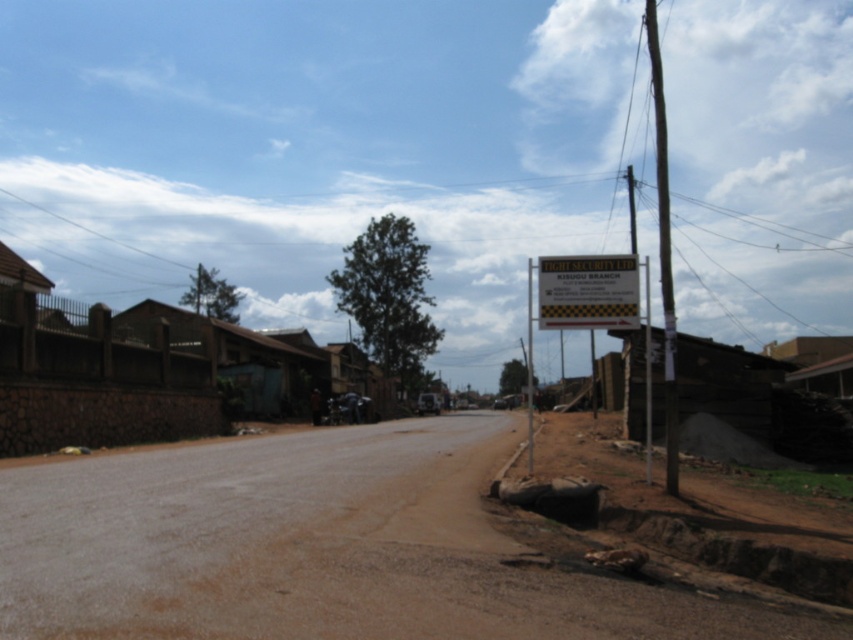
Question: Is metallic signboard at right to the right of smooth wood pole at right from the viewer's perspective?

Choices:
 (A) yes
 (B) no

Answer: (B)

Question: In this image, where is yellow/black checkered sign at center located relative to smooth wood pole at right?

Choices:
 (A) below
 (B) above

Answer: (A)

Question: Estimate the real-world distances between objects in this image. Which object is closer to the yellow/black checkered sign at center?

Choices:
 (A) smooth wood pole at right
 (B) brown dirt track at lower left
 (C) metallic signboard at right

Answer: (B)

Question: Which is farther from the smooth wood pole at right?

Choices:
 (A) metallic signboard at right
 (B) brown dirt track at lower left
 (C) yellow/black checkered sign at center

Answer: (C)

Question: Which of the following is the closest to the observer?

Choices:
 (A) yellow/black checkered sign at center
 (B) brown dirt track at lower left

Answer: (B)

Question: Is brown dirt track at lower left above yellow/black checkered sign at center?

Choices:
 (A) yes
 (B) no

Answer: (B)